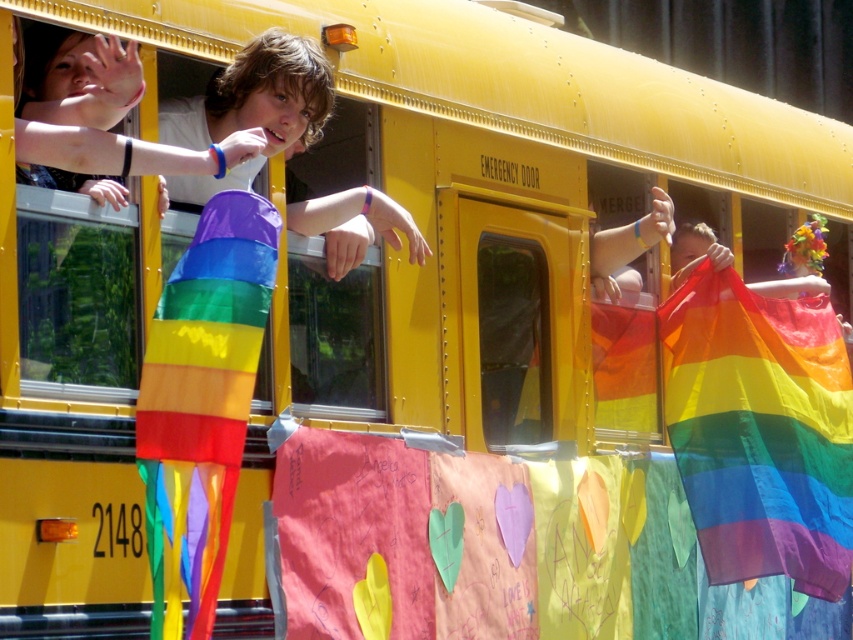
Question: Does rainbow fabric flag at center have a smaller size compared to rainbow fabric flag at left?

Choices:
 (A) no
 (B) yes

Answer: (A)

Question: Which point appears closest to the camera in this image?

Choices:
 (A) (822, 307)
 (B) (189, 410)

Answer: (B)

Question: Is rainbow fabric flag at center positioned at the back of rainbow fabric flag at left?

Choices:
 (A) no
 (B) yes

Answer: (B)

Question: Can you confirm if rainbow fabric flag at center is smaller than rainbow fabric flag at left?

Choices:
 (A) no
 (B) yes

Answer: (A)